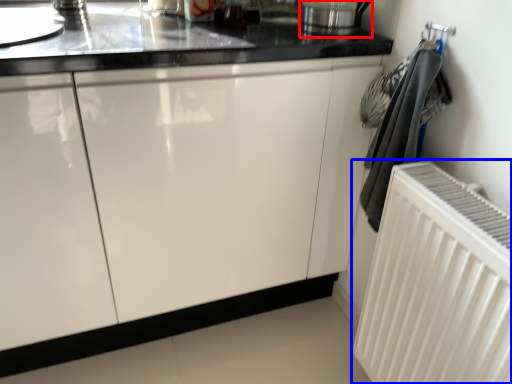
Question: Which object appears closest to the camera in this image, appliance (highlighted by a red box) or radiator (highlighted by a blue box)?

Choices:
 (A) appliance
 (B) radiator

Answer: (B)